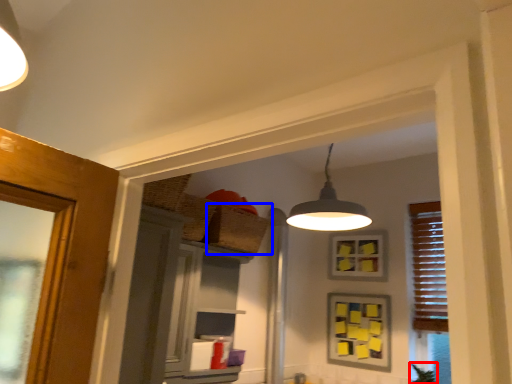
Question: Which of the following is the closest to the observer, plant (highlighted by a red box) or basket (highlighted by a blue box)?

Choices:
 (A) plant
 (B) basket

Answer: (B)